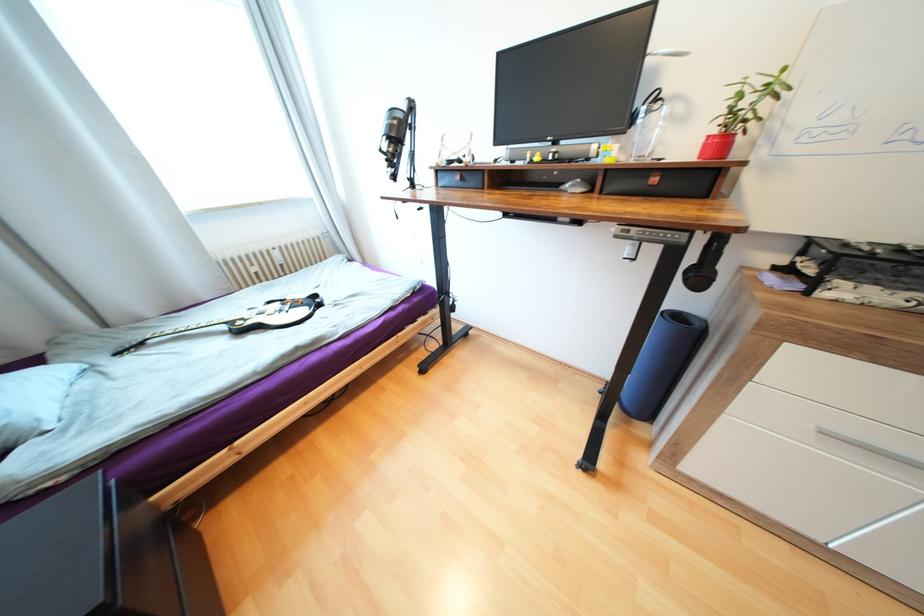
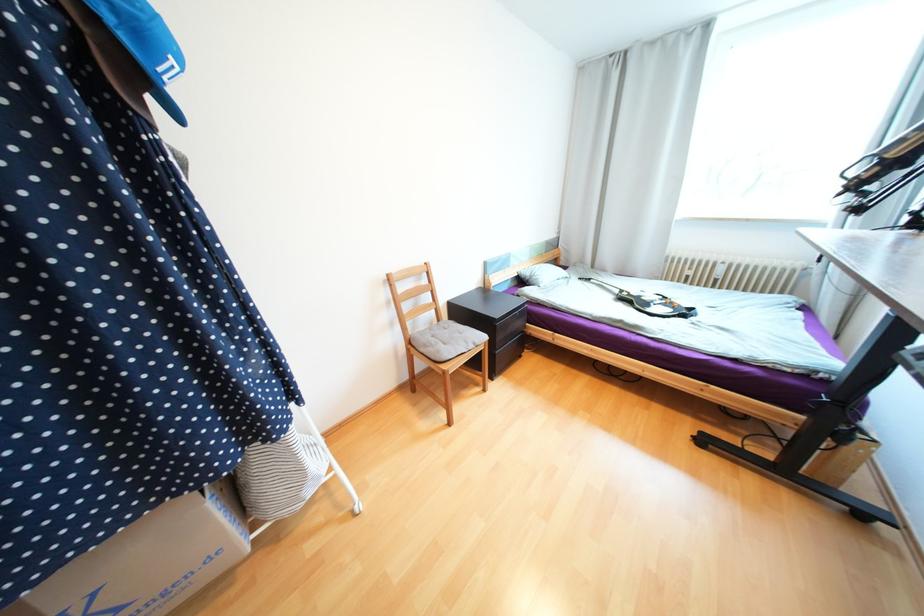
Find the pixel in the second image that matches (x=229, y=328) in the first image.

(623, 292)